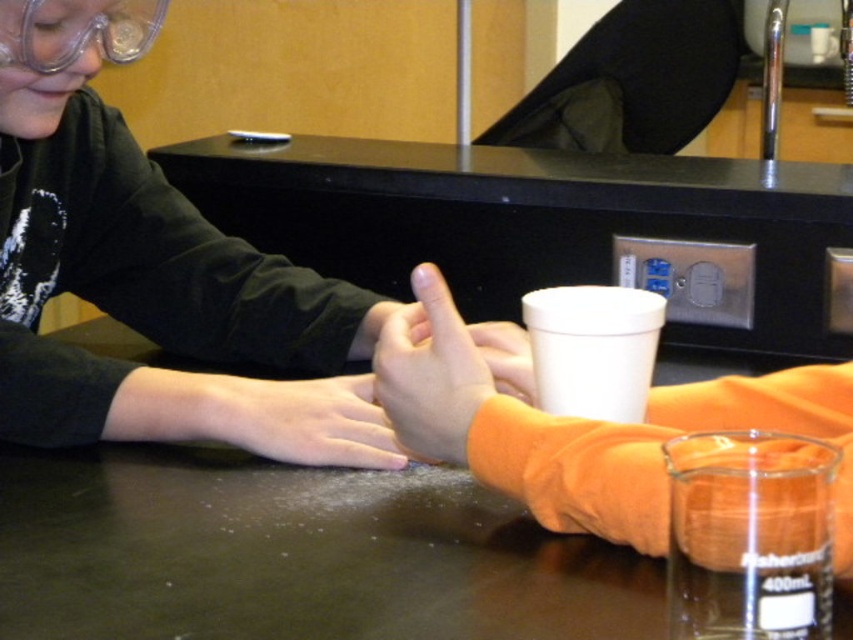
Question: Is orange fabric hand at center smaller than clear plastic goggles at upper left?

Choices:
 (A) yes
 (B) no

Answer: (B)

Question: Which point is closer to the camera?

Choices:
 (A) orange fabric hand at center
 (B) clear plastic goggles at upper left
 (C) smooth skin hand at center
 (D) translucent amber liquid at lower right

Answer: (D)

Question: Which point appears closest to the camera in this image?

Choices:
 (A) (9, 554)
 (B) (271, 403)

Answer: (A)

Question: In this image, where is smooth dark brown table at center located relative to orange fabric hand at center?

Choices:
 (A) right
 (B) left

Answer: (B)

Question: Which object is closer to the camera taking this photo?

Choices:
 (A) translucent amber liquid at lower right
 (B) orange fabric hand at center
 (C) smooth dark brown table at center
 (D) smooth skin hand at center

Answer: (A)

Question: Is smooth dark brown table at center behind smooth skin hand at center?

Choices:
 (A) yes
 (B) no

Answer: (B)